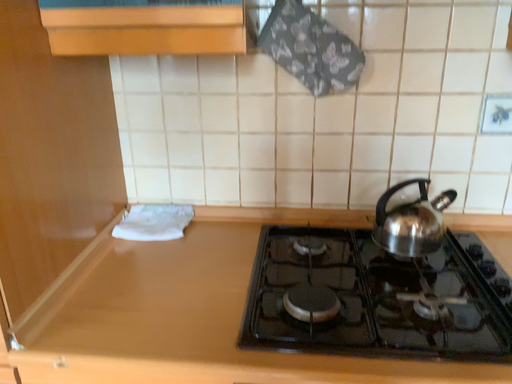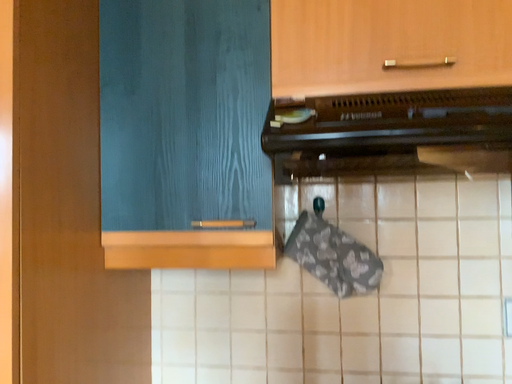
Question: Which way did the camera rotate in the video?

Choices:
 (A) rotated downward
 (B) rotated upward

Answer: (B)